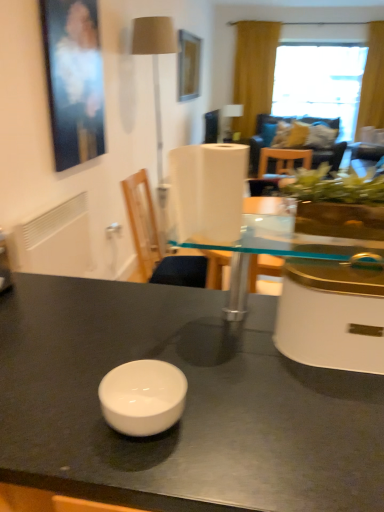
Question: Can you confirm if transparent glass table at center is bigger than wooden picture frame at upper center, positioned as the first picture frame in back-to-front order?

Choices:
 (A) no
 (B) yes

Answer: (A)

Question: From a real-world perspective, is transparent glass table at center on top of wooden picture frame at upper center, the 2th picture frame in the bottom-to-top sequence?

Choices:
 (A) no
 (B) yes

Answer: (A)

Question: Can you confirm if transparent glass table at center is shorter than wooden picture frame at upper center, the first picture frame in the top-to-bottom sequence?

Choices:
 (A) no
 (B) yes

Answer: (B)

Question: Can you confirm if transparent glass table at center is smaller than wooden picture frame at upper center, the 2th picture frame positioned from the front?

Choices:
 (A) yes
 (B) no

Answer: (A)

Question: Is transparent glass table at center located outside wooden picture frame at upper center, the 2th picture frame in the bottom-to-top sequence?

Choices:
 (A) no
 (B) yes

Answer: (B)

Question: Is transparent glass table at center thinner than wooden picture frame at upper center, the second picture frame in the left-to-right sequence?

Choices:
 (A) no
 (B) yes

Answer: (A)

Question: Is the position of transparent glass window at upper right more distant than that of beige fabric lampshade at upper left?

Choices:
 (A) no
 (B) yes

Answer: (B)

Question: Can you confirm if transparent glass window at upper right is positioned to the right of beige fabric lampshade at upper left?

Choices:
 (A) no
 (B) yes

Answer: (B)

Question: Could beige fabric lampshade at upper left be considered to be inside transparent glass window at upper right?

Choices:
 (A) no
 (B) yes

Answer: (A)

Question: Is transparent glass window at upper right in contact with beige fabric lampshade at upper left?

Choices:
 (A) yes
 (B) no

Answer: (B)

Question: Is transparent glass window at upper right at the left side of beige fabric lampshade at upper left?

Choices:
 (A) no
 (B) yes

Answer: (A)

Question: From a real-world perspective, is transparent glass window at upper right positioned over beige fabric lampshade at upper left based on gravity?

Choices:
 (A) yes
 (B) no

Answer: (B)

Question: Is white plastic chair at center thinner than transparent glass table at center?

Choices:
 (A) yes
 (B) no

Answer: (B)